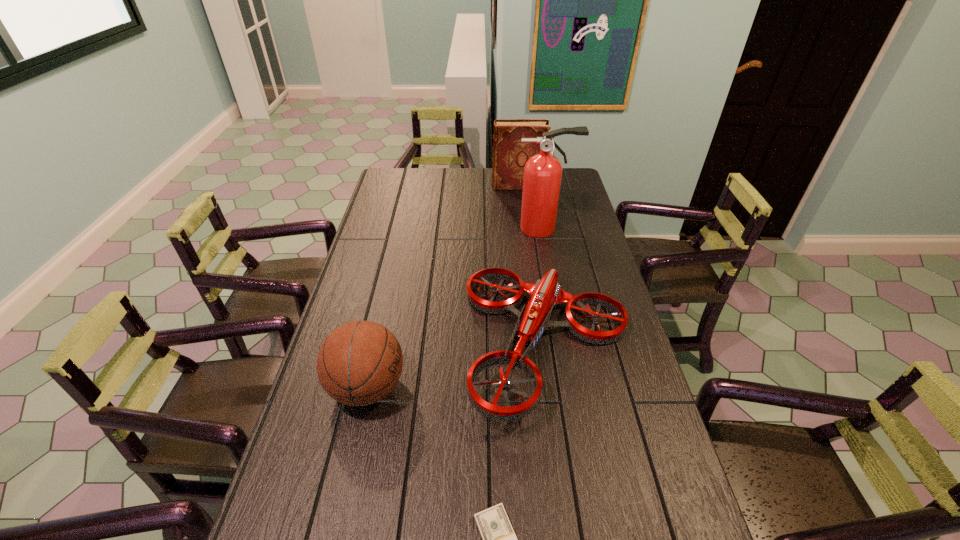
In order to click on the tallest object in this screenshot , I will do `click(542, 172)`.

Find the location of a particular element. The height and width of the screenshot is (540, 960). the fourth nearest object is located at coordinates (542, 172).

Image resolution: width=960 pixels, height=540 pixels. Identify the location of the second tallest object. (510, 154).

The image size is (960, 540). I want to click on hardback book, so click(x=510, y=154).

You are a GUI agent. You are given a task and a screenshot of the screen. Output one action in this format:
    pyautogui.click(x=<x>, y=<y>)
    Task: Click on the basketball
    This screenshot has width=960, height=540.
    Given the screenshot: What is the action you would take?
    pyautogui.click(x=359, y=363)

Identify the location of the leftmost object. The height and width of the screenshot is (540, 960). (359, 363).

Locate an element on the screen. Image resolution: width=960 pixels, height=540 pixels. drone is located at coordinates (546, 293).

Locate an element on the screen. The width and height of the screenshot is (960, 540). free location located on the front of the tallest object is located at coordinates (549, 251).

Where is `vacant space positioned 0.390m on the spine side of the farthest object`? This screenshot has height=540, width=960. vacant space positioned 0.390m on the spine side of the farthest object is located at coordinates (408, 186).

Where is `vacant region located 0.170m on the spine side of the farthest object`? The width and height of the screenshot is (960, 540). vacant region located 0.170m on the spine side of the farthest object is located at coordinates (455, 186).